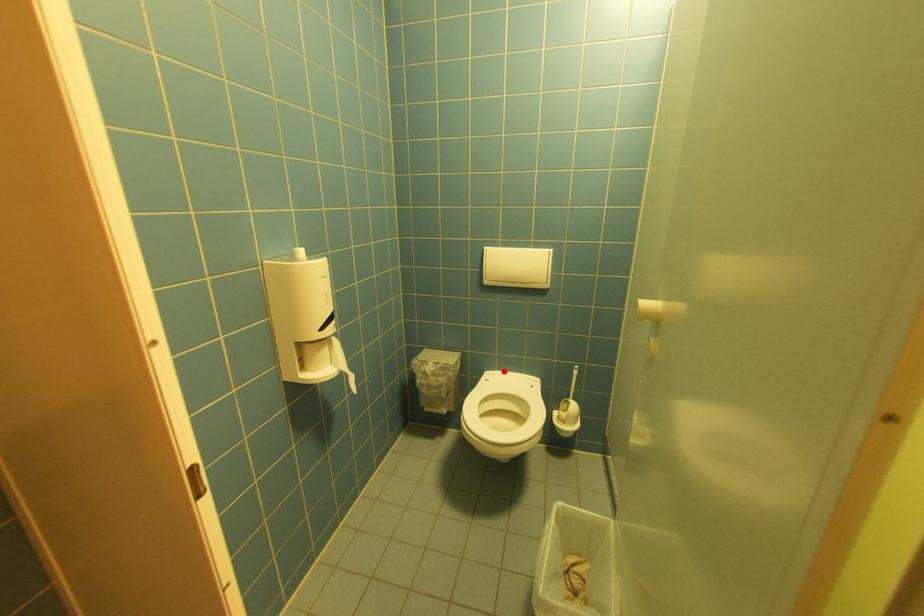
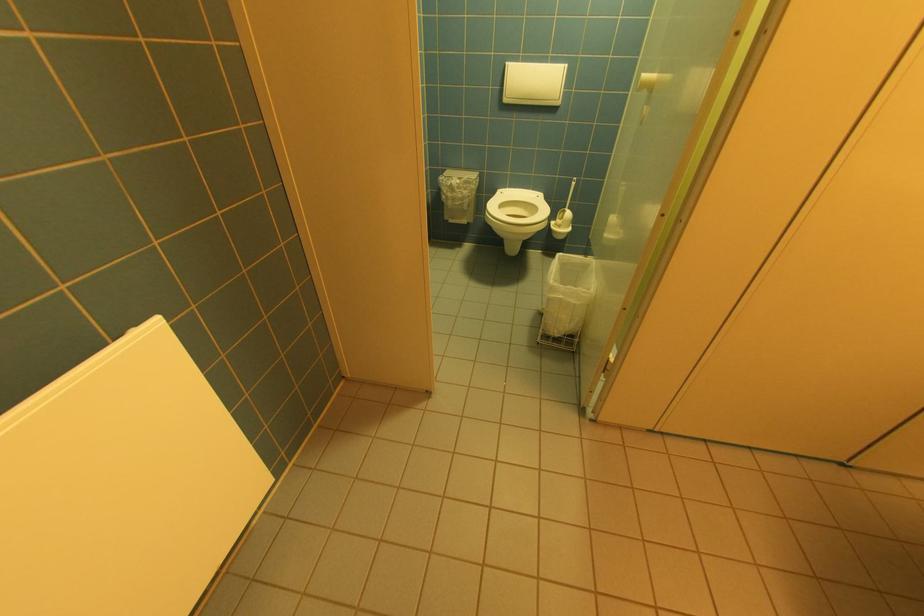
Find the pixel in the second image that matches the highlighted location in the first image.

(515, 188)